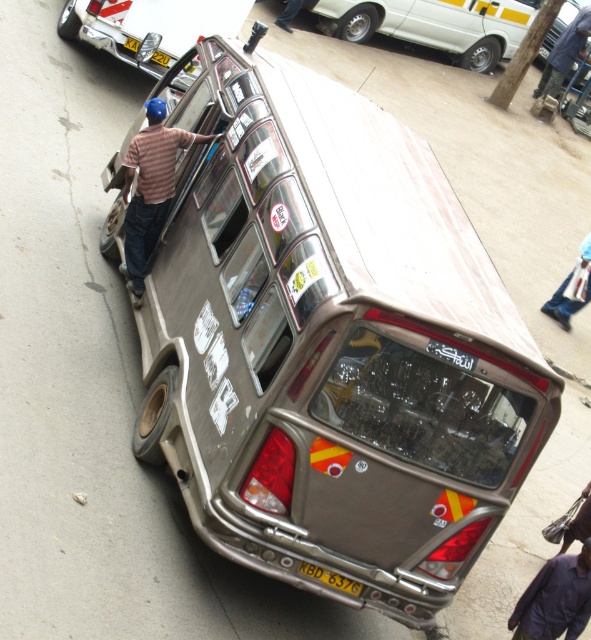
Question: Can you confirm if brown striped shirt at upper left is positioned to the right of yellow matte license plate at upper center?

Choices:
 (A) no
 (B) yes

Answer: (B)

Question: Which point is closer to the camera?

Choices:
 (A) (141, 19)
 (B) (476, 51)
 (C) (337, 577)

Answer: (C)

Question: Is white glossy van at upper right behind blue fabric bag at lower right?

Choices:
 (A) no
 (B) yes

Answer: (B)

Question: Which point is closer to the camera?

Choices:
 (A) yellow metallic license plate at bottom center
 (B) brown striped shirt at upper left
 (C) metallic silver van at center
 (D) metallic silver car at upper left

Answer: (C)

Question: Does brown striped shirt at upper left have a greater width compared to yellow matte license plate at upper center?

Choices:
 (A) no
 (B) yes

Answer: (B)

Question: Which point is farther to the camera?

Choices:
 (A) yellow matte license plate at upper center
 (B) yellow metallic license plate at bottom center

Answer: (A)